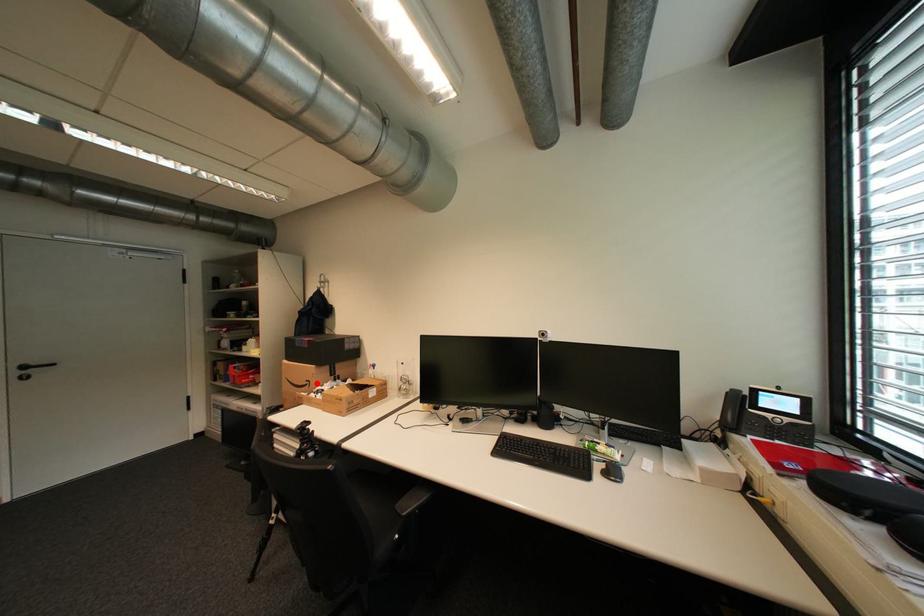
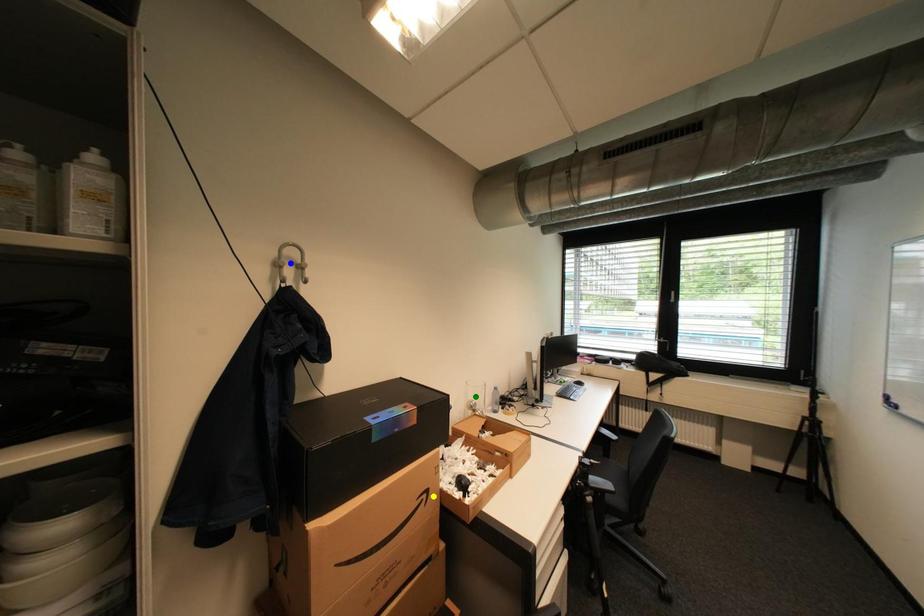
Question: I am providing you with two images of the same scene from different viewpoints. A red point is marked on the first image. You are given multiple points on the second image. Which point in image 2 is actually the same real-world point as the red point in image 1?

Choices:
 (A) blue point
 (B) green point
 (C) yellow point

Answer: (C)